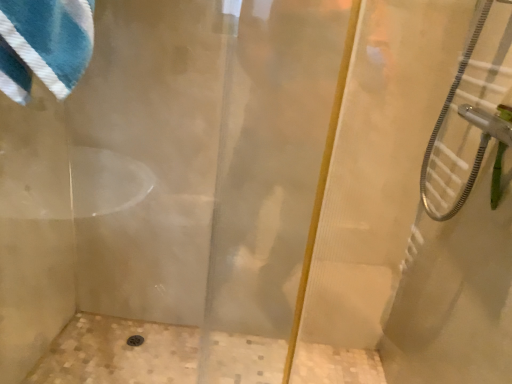
In order to face clear glass shower door at right, should I rotate leftwards or rightwards?

It's best to rotate right around 27.790 degrees.

What is the approximate height of clear glass shower door at right?

clear glass shower door at right is 24.53 inches in height.

Where is `clear glass shower door at right`? This screenshot has height=384, width=512. clear glass shower door at right is located at coordinates (469, 116).

This screenshot has height=384, width=512. What do you see at coordinates (469, 116) in the screenshot? I see `clear glass shower door at right` at bounding box center [469, 116].

Measure the distance between clear glass shower door at right and camera.

1.08 meters.

The height and width of the screenshot is (384, 512). I want to click on clear glass shower door at right, so pyautogui.click(x=469, y=116).